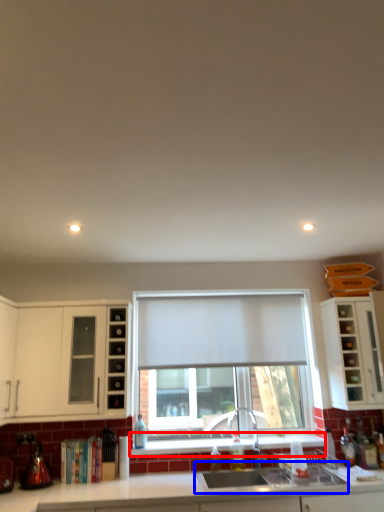
Question: Which of the following is the closest to the observer, window sill (highlighted by a red box) or sink (highlighted by a blue box)?

Choices:
 (A) window sill
 (B) sink

Answer: (B)